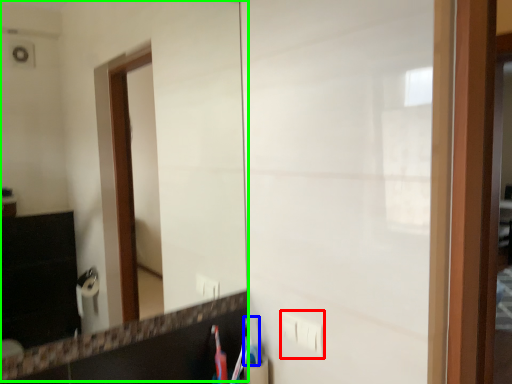
Question: Estimate the real-world distances between objects in this image. Which object is farther from electric outlet (highlighted by a red box), toothbrush (highlighted by a blue box) or mirror (highlighted by a green box)?

Choices:
 (A) toothbrush
 (B) mirror

Answer: (B)